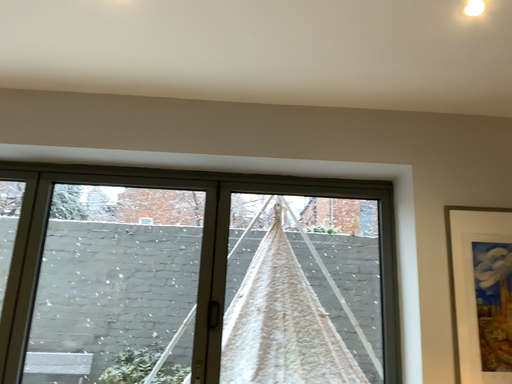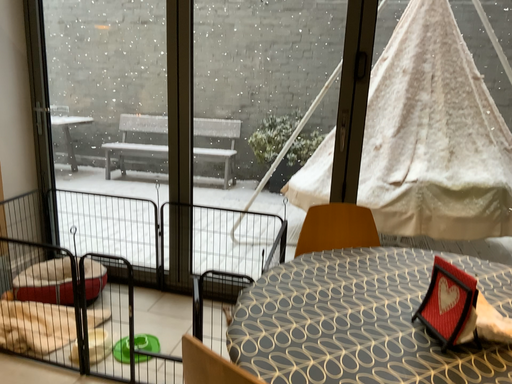
Question: Which way did the camera rotate in the video?

Choices:
 (A) rotated left
 (B) rotated right

Answer: (A)